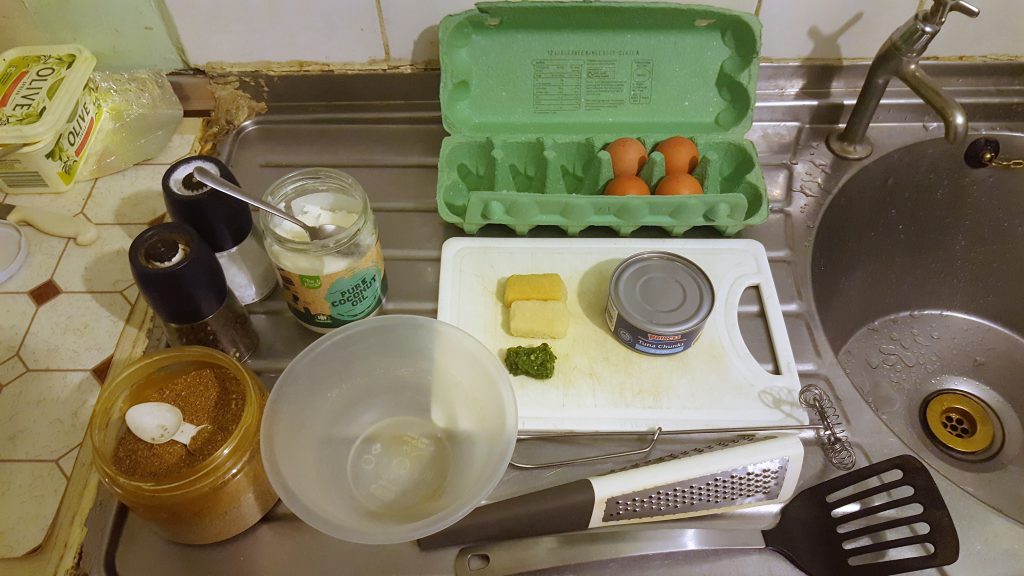
The width and height of the screenshot is (1024, 576). I want to click on handle, so click(x=593, y=541).